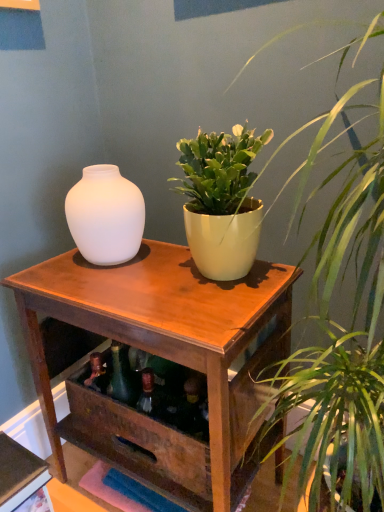
Where is `free space in front of matte white vase at left`? Image resolution: width=384 pixels, height=512 pixels. free space in front of matte white vase at left is located at coordinates (105, 290).